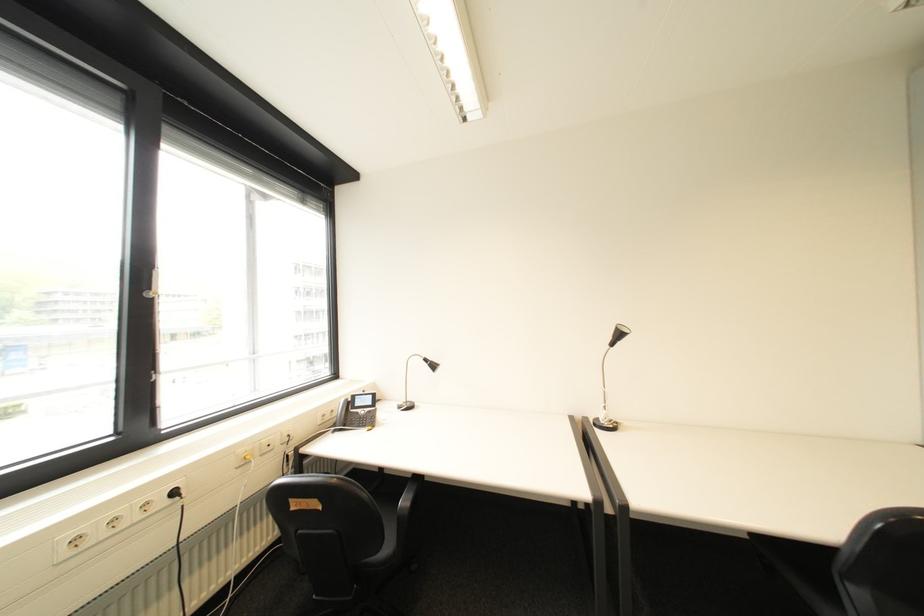
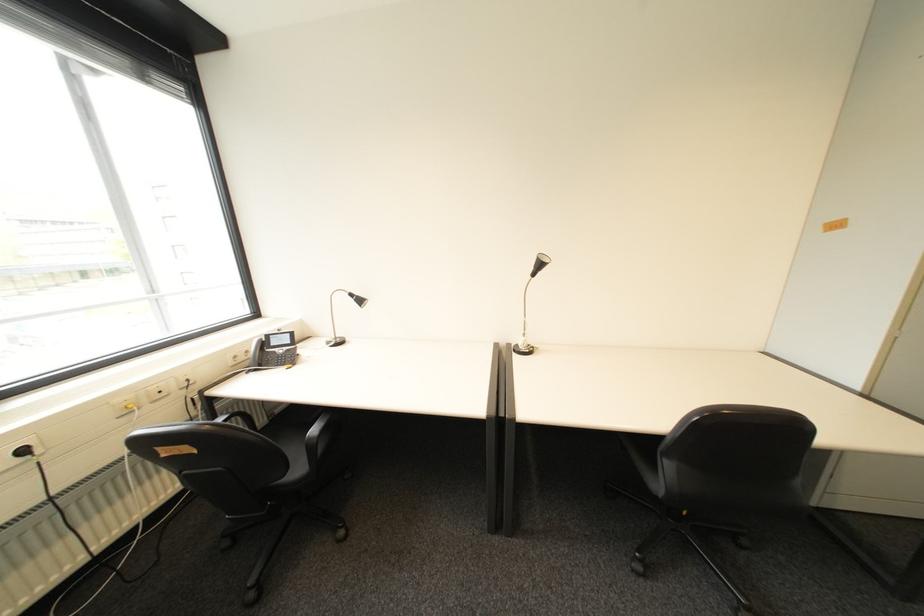
Locate, in the second image, the point that corresponds to (185,493) in the first image.

(34, 452)